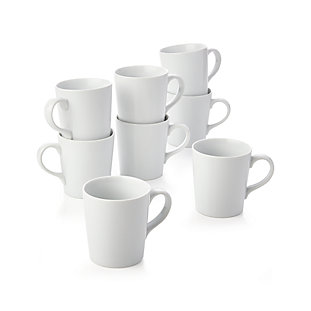
Image resolution: width=311 pixels, height=311 pixels. Find the location of `cups`. cups is located at coordinates (190, 67), (192, 117), (142, 94), (155, 151), (209, 176), (131, 213), (83, 156), (85, 115).